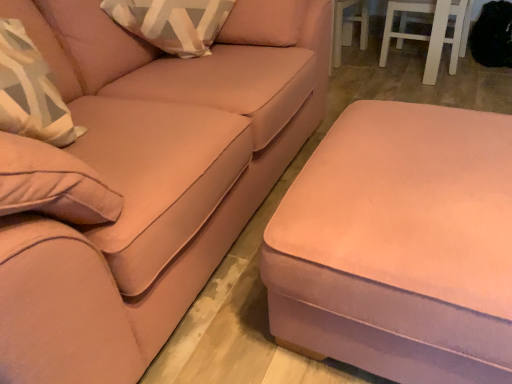
Question: Can you confirm if matte pink ottoman at lower right is wider than matte pink ottoman at lower right?

Choices:
 (A) yes
 (B) no

Answer: (B)

Question: Is matte pink ottoman at lower right closer to the viewer compared to matte pink ottoman at lower right?

Choices:
 (A) yes
 (B) no

Answer: (B)

Question: Considering the relative sizes of matte pink ottoman at lower right and matte pink ottoman at lower right in the image provided, is matte pink ottoman at lower right bigger than matte pink ottoman at lower right?

Choices:
 (A) yes
 (B) no

Answer: (B)

Question: Can you confirm if matte pink ottoman at lower right is positioned to the right of matte pink ottoman at lower right?

Choices:
 (A) yes
 (B) no

Answer: (A)

Question: Is matte pink ottoman at lower right in contact with matte pink ottoman at lower right?

Choices:
 (A) yes
 (B) no

Answer: (B)

Question: From the image's perspective, is matte pink ottoman at lower right located above matte pink ottoman at lower right?

Choices:
 (A) no
 (B) yes

Answer: (A)

Question: Is matte pink ottoman at lower right oriented towards matte pink ottoman at lower right?

Choices:
 (A) yes
 (B) no

Answer: (A)

Question: From the image's perspective, is matte pink ottoman at lower right located above matte pink ottoman at lower right?

Choices:
 (A) yes
 (B) no

Answer: (A)

Question: Is matte pink ottoman at lower right to the left of matte pink ottoman at lower right from the viewer's perspective?

Choices:
 (A) no
 (B) yes

Answer: (B)

Question: Is the position of matte pink ottoman at lower right less distant than that of matte pink ottoman at lower right?

Choices:
 (A) no
 (B) yes

Answer: (B)

Question: Is matte pink ottoman at lower right facing away from matte pink ottoman at lower right?

Choices:
 (A) no
 (B) yes

Answer: (A)

Question: Does matte pink ottoman at lower right contain matte pink ottoman at lower right?

Choices:
 (A) no
 (B) yes

Answer: (A)

Question: Choose the correct answer: Is matte pink ottoman at lower right inside matte pink ottoman at lower right or outside it?

Choices:
 (A) outside
 (B) inside

Answer: (A)